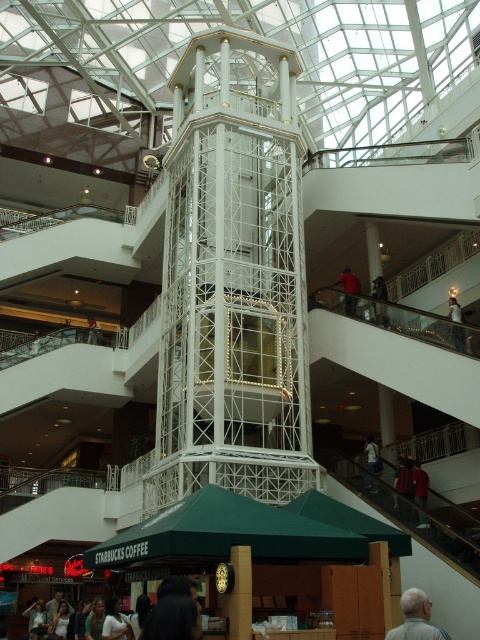
From the picture: You are standing at the point marked at coordinate point (x=210, y=490) in the mall. You want to walk to the Starbucks Coffee shop located on the lower level. If your walking speed is 1.2 meters per second, how many seconds will it take you to reach the Starbucks Coffee shop?

The distance between the point marked at coordinate point (x=210, y=490) and the Starbucks Coffee shop is 35.62 meters. At a walking speed of 1.2 meters per second, it will take approximately 29.68 seconds to reach the Starbucks Coffee shop.

You are standing at the entrance of the shopping mall and want to locate the green fabric canopy at lower center. According to the coordinates provided, in which direction should you look to find it?

The green fabric canopy at lower center is located at coordinates point (226, 534), which is towards the lower center direction from your current position at the entrance.